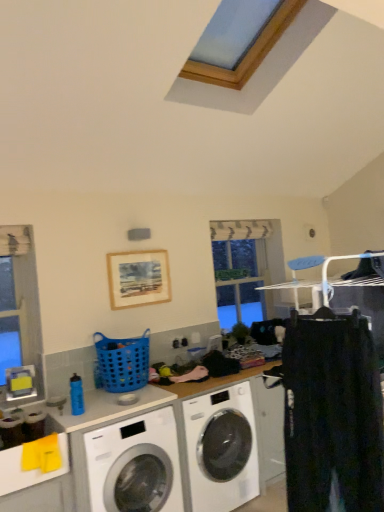
Question: Considering the positions of clear glass window at center and white glossy washing machine at lower left, which is the second washing machine from right to left, in the image, is clear glass window at center taller or shorter than white glossy washing machine at lower left, which is the second washing machine from right to left,?

Choices:
 (A) tall
 (B) short

Answer: (A)

Question: From a real-world perspective, relative to white glossy washing machine at lower left, the 1th washing machine in the left-to-right sequence, is clear glass window at center vertically above or below?

Choices:
 (A) below
 (B) above

Answer: (B)

Question: Which object is the farthest from the white glossy washing machine at center, the first washing machine in the right-to-left sequence?

Choices:
 (A) blue plastic basket at center
 (B) white glossy washing machine at lower left, the 1th washing machine in the left-to-right sequence
 (C) black cotton pants at right
 (D) wooden picture frame at upper center
 (E) clear glass window at center

Answer: (E)

Question: Which of these objects is positioned farthest from the clear glass window at center?

Choices:
 (A) wooden picture frame at upper center
 (B) blue plastic basket at center
 (C) black cotton pants at right
 (D) white glossy washing machine at center, the 2th washing machine positioned from the left
 (E) white glossy washing machine at lower left, the 1th washing machine in the left-to-right sequence

Answer: (C)